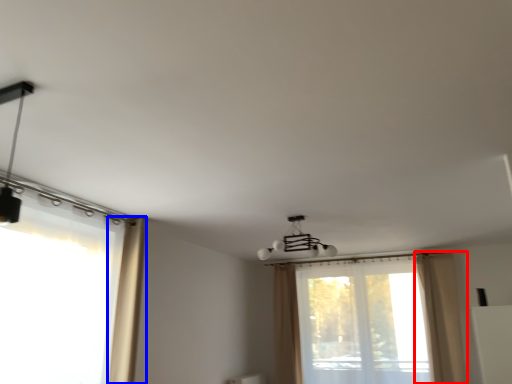
Question: Which point is closer to the camera, curtain (highlighted by a red box) or curtain (highlighted by a blue box)?

Choices:
 (A) curtain
 (B) curtain

Answer: (B)